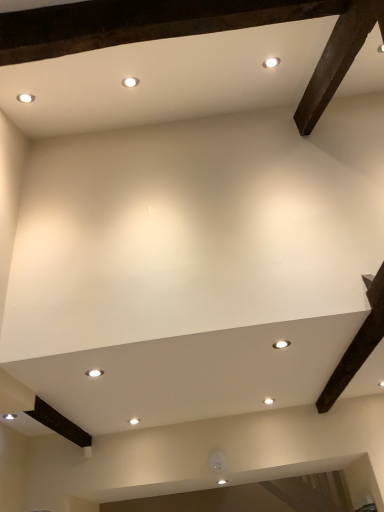
Image resolution: width=384 pixels, height=512 pixels. Describe the element at coordinates (94, 373) in the screenshot. I see `white glossy light fixture at center, positioned as the 1th lighting in bottom-to-top order` at that location.

This screenshot has width=384, height=512. I want to click on white glossy light fixture at center, positioned as the 1th lighting in bottom-to-top order, so click(94, 373).

What do you see at coordinates (281, 344) in the screenshot? The height and width of the screenshot is (512, 384). I see `white glossy light fixture at center, the 2th lighting from the left` at bounding box center [281, 344].

At what (x,y) coordinates should I click in order to perform the action: click on white glossy light fixture at center, acting as the 1th lighting starting from the top. Please return your answer as a coordinate pair (x, y). Looking at the image, I should click on (281, 344).

Locate an element on the screen. The image size is (384, 512). white glossy light fixture at center, arranged as the first lighting when viewed from the left is located at coordinates (94, 373).

Is white glossy light fixture at center, acting as the 1th lighting starting from the top, at the left side of white glossy light fixture at center, positioned as the 1th lighting in bottom-to-top order?

In fact, white glossy light fixture at center, acting as the 1th lighting starting from the top, is to the right of white glossy light fixture at center, positioned as the 1th lighting in bottom-to-top order.

Which object is further away from the camera taking this photo, white glossy light fixture at center, acting as the 1th lighting starting from the top, or white glossy light fixture at center, which is the 2th lighting in right-to-left order?

white glossy light fixture at center, which is the 2th lighting in right-to-left order.

Is point (279, 341) closer to camera compared to point (92, 376)?

Yes.

From the image's perspective, is white glossy light fixture at center, the second lighting positioned from the bottom, below white glossy light fixture at center, positioned as the 1th lighting in bottom-to-top order?

No, from the image's perspective, white glossy light fixture at center, the second lighting positioned from the bottom, is not below white glossy light fixture at center, positioned as the 1th lighting in bottom-to-top order.

Based on the photo, from a real-world perspective, is white glossy light fixture at center, the second lighting positioned from the bottom, physically located above or below white glossy light fixture at center, positioned as the 1th lighting in bottom-to-top order?

From a real-world perspective, white glossy light fixture at center, the second lighting positioned from the bottom, is physically above white glossy light fixture at center, positioned as the 1th lighting in bottom-to-top order.

Between white glossy light fixture at center, acting as the 1th lighting starting from the top, and white glossy light fixture at center, arranged as the first lighting when viewed from the left, which one has larger width?

With larger width is white glossy light fixture at center, acting as the 1th lighting starting from the top.

Does white glossy light fixture at center, the 1th lighting viewed from the right, have a greater height compared to white glossy light fixture at center, arranged as the first lighting when viewed from the left?

Incorrect, the height of white glossy light fixture at center, the 1th lighting viewed from the right, is not larger of that of white glossy light fixture at center, arranged as the first lighting when viewed from the left.

Looking at this image, considering the sizes of white glossy light fixture at center, acting as the 1th lighting starting from the top, and white glossy light fixture at center, marked as the second lighting in a top-to-bottom arrangement, in the image, is white glossy light fixture at center, acting as the 1th lighting starting from the top, bigger or smaller than white glossy light fixture at center, marked as the second lighting in a top-to-bottom arrangement,?

In the image, white glossy light fixture at center, acting as the 1th lighting starting from the top, appears to be smaller than white glossy light fixture at center, marked as the second lighting in a top-to-bottom arrangement.

Is white glossy light fixture at center, acting as the 1th lighting starting from the top, inside the boundaries of white glossy light fixture at center, marked as the second lighting in a top-to-bottom arrangement, or outside?

white glossy light fixture at center, acting as the 1th lighting starting from the top, is not enclosed by white glossy light fixture at center, marked as the second lighting in a top-to-bottom arrangement.

Is white glossy light fixture at center, the 2th lighting from the left, far away from white glossy light fixture at center, which is the 2th lighting in right-to-left order?

No.

Is white glossy light fixture at center, acting as the 1th lighting starting from the top, looking in the opposite direction of white glossy light fixture at center, positioned as the 1th lighting in bottom-to-top order?

No, white glossy light fixture at center, positioned as the 1th lighting in bottom-to-top order, is not at the back of white glossy light fixture at center, acting as the 1th lighting starting from the top.

How distant is white glossy light fixture at center, the 2th lighting from the left, from white glossy light fixture at center, which is the 2th lighting in right-to-left order?

The distance of white glossy light fixture at center, the 2th lighting from the left, from white glossy light fixture at center, which is the 2th lighting in right-to-left order, is 39.07 inches.

In the image, there is a white glossy light fixture at center, the second lighting positioned from the bottom. Where is `lighting below it (from the image's perspective)`? The width and height of the screenshot is (384, 512). lighting below it (from the image's perspective) is located at coordinates (94, 373).

Does white glossy light fixture at center, arranged as the first lighting when viewed from the left, appear on the left side of white glossy light fixture at center, the second lighting positioned from the bottom?

Correct, you'll find white glossy light fixture at center, arranged as the first lighting when viewed from the left, to the left of white glossy light fixture at center, the second lighting positioned from the bottom.

Is white glossy light fixture at center, arranged as the first lighting when viewed from the left, closer to the viewer compared to white glossy light fixture at center, the 1th lighting viewed from the right?

No, white glossy light fixture at center, arranged as the first lighting when viewed from the left, is further to the viewer.

Considering the positions of point (88, 374) and point (282, 340), is point (88, 374) closer or farther from the camera than point (282, 340)?

Point (88, 374) appears to be farther away from the viewer than point (282, 340).

From the image's perspective, is white glossy light fixture at center, which is the 2th lighting in right-to-left order, positioned above or below white glossy light fixture at center, the 1th lighting viewed from the right?

white glossy light fixture at center, which is the 2th lighting in right-to-left order, is below white glossy light fixture at center, the 1th lighting viewed from the right.

From a real-world perspective, which is physically above, white glossy light fixture at center, arranged as the first lighting when viewed from the left, or white glossy light fixture at center, acting as the 1th lighting starting from the top?

white glossy light fixture at center, acting as the 1th lighting starting from the top, is physically above.

Considering the relative sizes of white glossy light fixture at center, which is the 2th lighting in right-to-left order, and white glossy light fixture at center, the 2th lighting from the left, in the image provided, is white glossy light fixture at center, which is the 2th lighting in right-to-left order, wider than white glossy light fixture at center, the 2th lighting from the left,?

No, white glossy light fixture at center, which is the 2th lighting in right-to-left order, is not wider than white glossy light fixture at center, the 2th lighting from the left.

Is white glossy light fixture at center, arranged as the first lighting when viewed from the left, taller than white glossy light fixture at center, acting as the 1th lighting starting from the top?

Correct, white glossy light fixture at center, arranged as the first lighting when viewed from the left, is much taller as white glossy light fixture at center, acting as the 1th lighting starting from the top.

Who is smaller, white glossy light fixture at center, arranged as the first lighting when viewed from the left, or white glossy light fixture at center, acting as the 1th lighting starting from the top?

white glossy light fixture at center, acting as the 1th lighting starting from the top, is smaller.

Based on the photo, is white glossy light fixture at center, which is the 2th lighting in right-to-left order, situated inside white glossy light fixture at center, the second lighting positioned from the bottom, or outside?

white glossy light fixture at center, which is the 2th lighting in right-to-left order, is spatially situated outside white glossy light fixture at center, the second lighting positioned from the bottom.

Is white glossy light fixture at center, marked as the second lighting in a top-to-bottom arrangement, with white glossy light fixture at center, the second lighting positioned from the bottom?

No, white glossy light fixture at center, marked as the second lighting in a top-to-bottom arrangement, is not touching white glossy light fixture at center, the second lighting positioned from the bottom.

Is white glossy light fixture at center, positioned as the 1th lighting in bottom-to-top order, aimed at white glossy light fixture at center, the 2th lighting from the left?

No, white glossy light fixture at center, positioned as the 1th lighting in bottom-to-top order, is not turned towards white glossy light fixture at center, the 2th lighting from the left.

Looking at this image, what's the angular difference between white glossy light fixture at center, which is the 2th lighting in right-to-left order, and white glossy light fixture at center, the 1th lighting viewed from the right,'s facing directions?

6.1 degrees separate the facing orientations of white glossy light fixture at center, which is the 2th lighting in right-to-left order, and white glossy light fixture at center, the 1th lighting viewed from the right.

Consider the image. Measure the distance between white glossy light fixture at center, which is the 2th lighting in right-to-left order, and white glossy light fixture at center, the second lighting positioned from the bottom.

A distance of 99.25 centimeters exists between white glossy light fixture at center, which is the 2th lighting in right-to-left order, and white glossy light fixture at center, the second lighting positioned from the bottom.

Find the location of `lighting on the right side of white glossy light fixture at center, which is the 2th lighting in right-to-left order`. lighting on the right side of white glossy light fixture at center, which is the 2th lighting in right-to-left order is located at coordinates (281, 344).

Where is `lighting beneath the white glossy light fixture at center, acting as the 1th lighting starting from the top (from a real-world perspective)`? This screenshot has width=384, height=512. lighting beneath the white glossy light fixture at center, acting as the 1th lighting starting from the top (from a real-world perspective) is located at coordinates (94, 373).

Locate an element on the screen. lighting that appears behind the white glossy light fixture at center, the 2th lighting from the left is located at coordinates (94, 373).